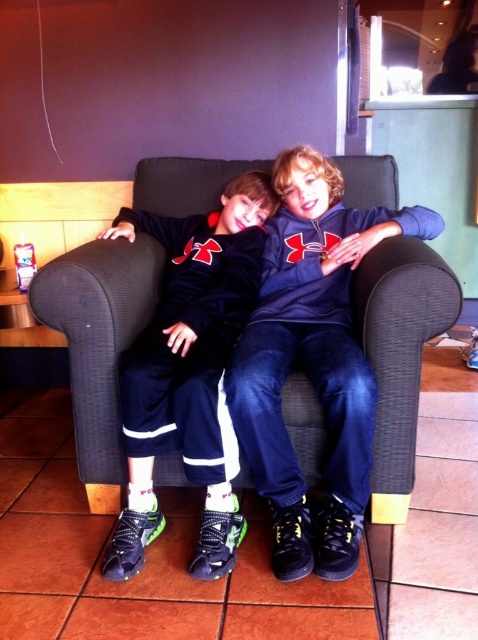
Question: Among these objects, which one is nearest to the camera?

Choices:
 (A) matte black pants at center
 (B) matte blue hoodie at center

Answer: (B)

Question: Does matte blue hoodie at center appear over matte black pants at center?

Choices:
 (A) yes
 (B) no

Answer: (A)

Question: Among these points, which one is nearest to the camera?

Choices:
 (A) (180, 390)
 (B) (310, 253)
 (C) (41, 317)

Answer: (A)

Question: Is the position of dark blue fabric couch at center less distant than that of matte blue hoodie at center?

Choices:
 (A) yes
 (B) no

Answer: (B)

Question: Does dark blue fabric couch at center have a greater width compared to matte blue hoodie at center?

Choices:
 (A) yes
 (B) no

Answer: (A)

Question: Estimate the real-world distances between objects in this image. Which object is farther from the matte black pants at center?

Choices:
 (A) dark blue fabric couch at center
 (B) matte blue hoodie at center

Answer: (A)